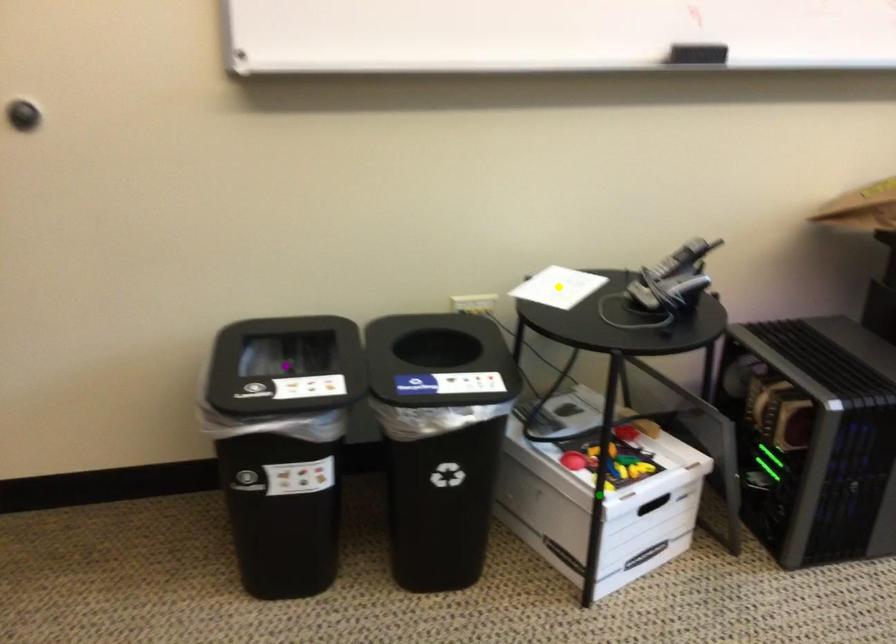
Order these from nearest to farthest:
A) green point
B) purple point
C) yellow point

purple point, green point, yellow point